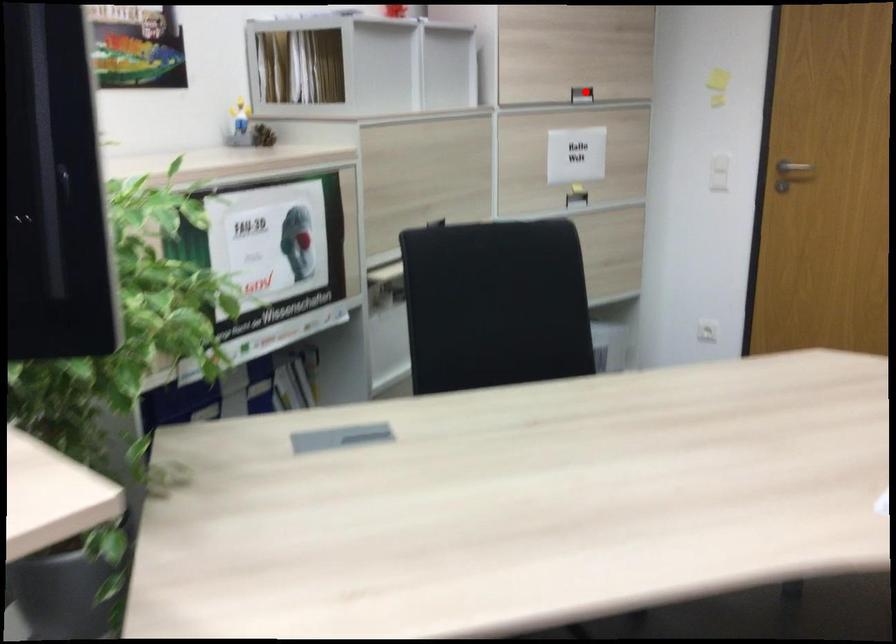
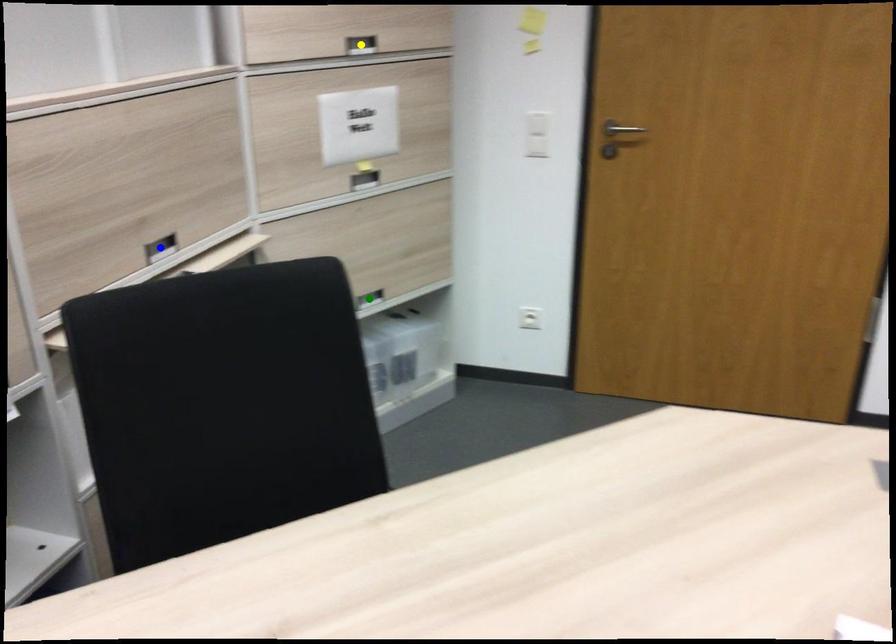
Question: I am providing you with two images of the same scene from different viewpoints. A red point is marked on the first image. You are given multiple points on the second image. Which point in image 2 is actually the same real-world point as the red point in image 1?

Choices:
 (A) green point
 (B) blue point
 (C) yellow point

Answer: (C)